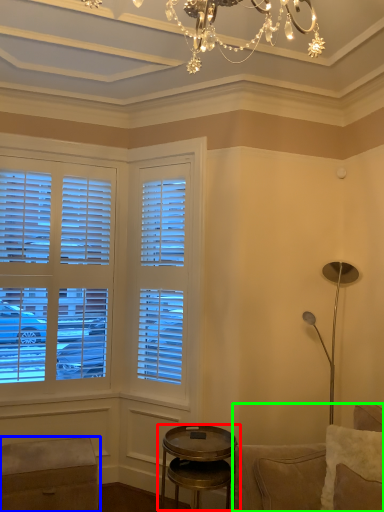
Question: Which is nearer to the table (highlighted by a red box)? music stool (highlighted by a blue box) or studio couch (highlighted by a green box).

Choices:
 (A) music stool
 (B) studio couch

Answer: (B)